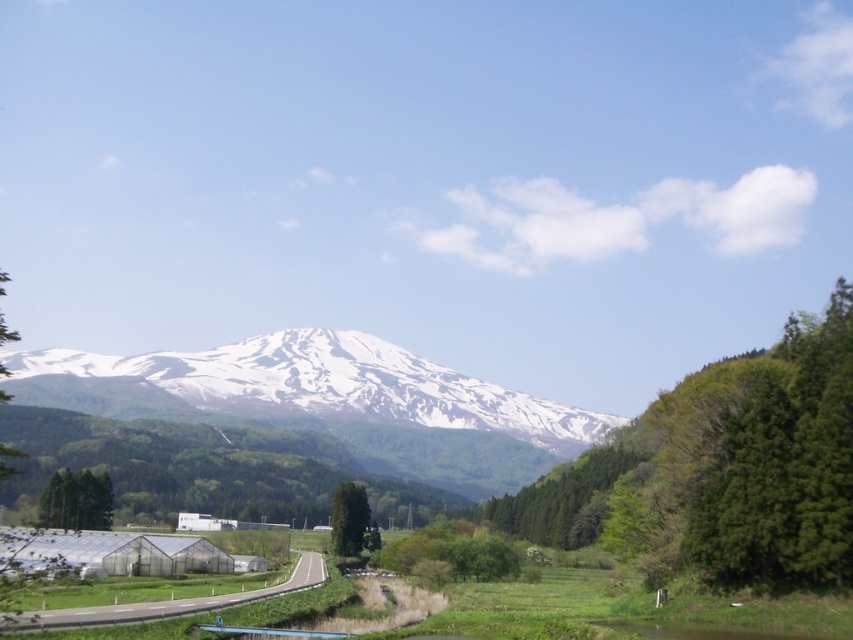
Does point (384, 355) lie in front of point (358, 552)?

That is False.

Locate an element on the screen. This screenshot has width=853, height=640. white snow-covered mountain at center is located at coordinates (299, 387).

Consider the image. Can you confirm if white snow-covered mountain at center is thinner than green matte tree at lower left?

No, white snow-covered mountain at center is not thinner than green matte tree at lower left.

Who is lower down, white snow-covered mountain at center or green matte tree at lower left?

green matte tree at lower left is below.

Is point (421, 413) in front of point (71, 476)?

No, (421, 413) is further to viewer.

Locate an element on the screen. Image resolution: width=853 pixels, height=640 pixels. white snow-covered mountain at center is located at coordinates pos(299,387).

Does green matte tree at lower left have a greater height compared to green matte tree at center?

Yes, green matte tree at lower left is taller than green matte tree at center.

Who is lower down, green matte tree at lower left or green matte tree at center?

green matte tree at center is below.

Does point (38, 508) come in front of point (338, 515)?

That is True.

I want to click on green matte tree at lower left, so click(x=76, y=500).